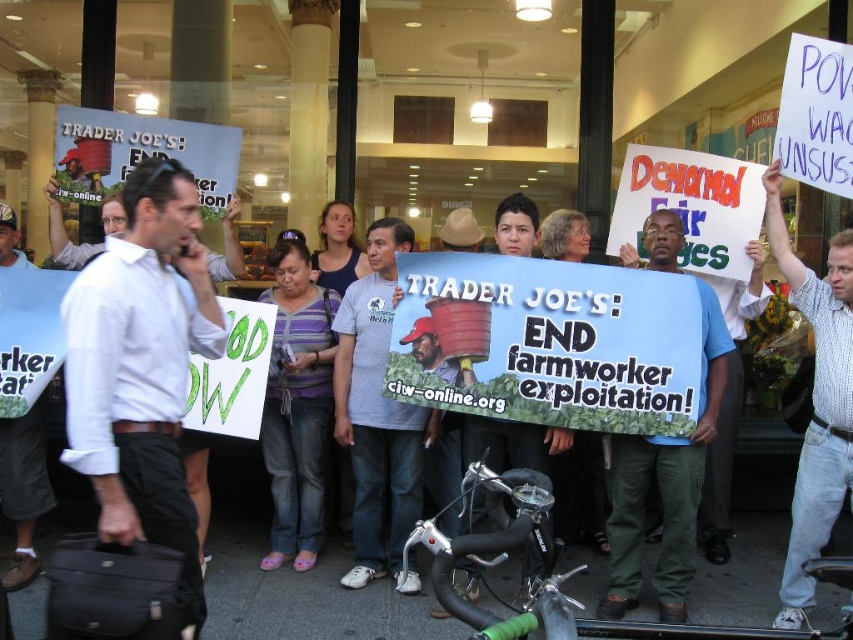
Question: Does white checkered shirt at upper right appear over purple striped shirt at center?

Choices:
 (A) yes
 (B) no

Answer: (A)

Question: Is white checkered shirt at upper right wider than purple striped shirt at center?

Choices:
 (A) yes
 (B) no

Answer: (B)

Question: Does white checkered shirt at upper right lie behind purple striped shirt at center?

Choices:
 (A) yes
 (B) no

Answer: (B)

Question: Which point is closer to the camera taking this photo?

Choices:
 (A) (817, 480)
 (B) (274, 360)

Answer: (A)

Question: Which point is closer to the camera taking this photo?

Choices:
 (A) 822,307
 (B) 329,317

Answer: (A)